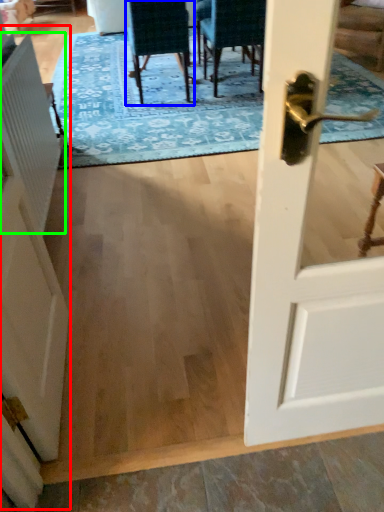
Question: Estimate the real-world distances between objects in this image. Which object is farther from barn door (highlighted by a red box), chair (highlighted by a blue box) or radiator (highlighted by a green box)?

Choices:
 (A) chair
 (B) radiator

Answer: (A)